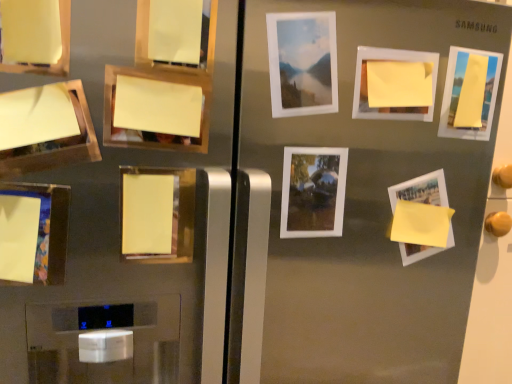
Question: In terms of size, does yellow matte paper at center, which appears as the fourth picture frame when viewed from the left, appear bigger or smaller than yellow paper at upper left, the 10th picture frame positioned from the right?

Choices:
 (A) big
 (B) small

Answer: (B)

Question: Based on their positions, is yellow matte paper at center, placed as the eighth picture frame when sorted from right to left, located to the left or right of yellow paper at upper left, which appears as the 2th picture frame when viewed from the left?

Choices:
 (A) left
 (B) right

Answer: (B)

Question: Considering the real-world distances, which object is farthest from the matte yellow paper at lower left, arranged as the 1th picture frame when viewed from the left?

Choices:
 (A) yellow paper at upper left, the 10th picture frame positioned from the right
 (B) matte white picture frame at upper center, which is counted as the 5th picture frame, starting from the right
 (C) yellow matte paper at bottom right, the second picture frame when ordered from right to left
 (D) yellow matte paper at upper right, which is counted as the eleventh picture frame, starting from the left
 (E) yellow paper at upper left, arranged as the 7th picture frame when viewed from the right

Answer: (D)

Question: Which object is the farthest from the yellow matte paper at upper right, the 9th picture frame in the left-to-right sequence?

Choices:
 (A) yellow matte paper at center, placed as the eighth picture frame when sorted from right to left
 (B) yellow matte paper at bottom right, the second picture frame when ordered from right to left
 (C) yellow matte paper at upper right, which is counted as the first picture frame, starting from the right
 (D) yellow paper at upper left, the fifth picture frame when ordered from left to right
 (E) matte yellow paper at lower left, which appears as the 11th picture frame when viewed from the right

Answer: (E)